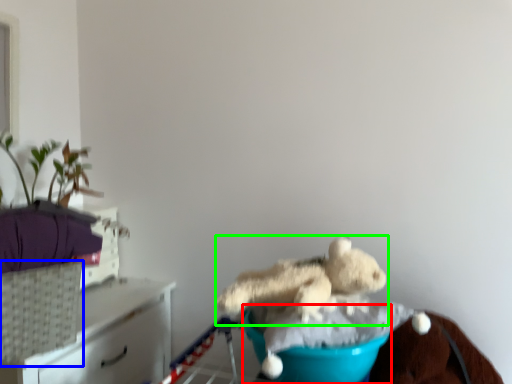
Question: Based on their relative distances, which object is nearer to teal (highlighted by a red box)? Choose from basket (highlighted by a blue box) and teddy bear (highlighted by a green box).

Choices:
 (A) basket
 (B) teddy bear

Answer: (B)